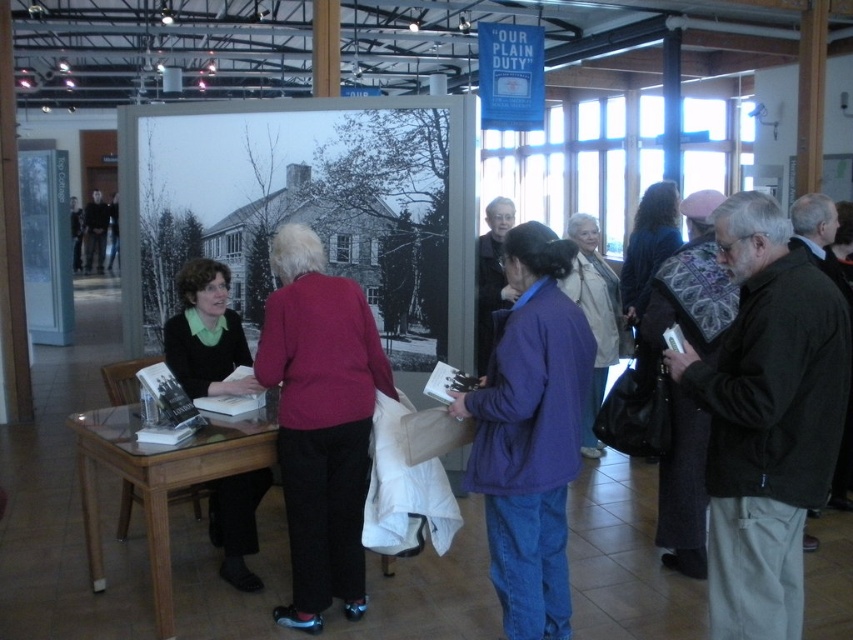
Question: Is clear glass table at lower left closer to camera compared to matte black sweater at center?

Choices:
 (A) yes
 (B) no

Answer: (A)

Question: Among these objects, which one is nearest to the camera?

Choices:
 (A) dark brown jacket at center
 (B) clear glass table at lower left
 (C) maroon fabric jacket at center

Answer: (A)

Question: Is dark brown jacket at center thinner than maroon fabric jacket at center?

Choices:
 (A) no
 (B) yes

Answer: (B)

Question: Which object is positioned closest to the clear glass table at lower left?

Choices:
 (A) dark brown jacket at center
 (B) purple matte jacket at center
 (C) matte black sweater at center

Answer: (C)

Question: Considering the real-world distances, which object is farthest from the purple matte jacket at center?

Choices:
 (A) maroon fabric jacket at center
 (B) matte black sweater at center
 (C) dark brown jacket at center

Answer: (B)

Question: Is purple matte jacket at center to the right of maroon fabric jacket at center from the viewer's perspective?

Choices:
 (A) yes
 (B) no

Answer: (A)